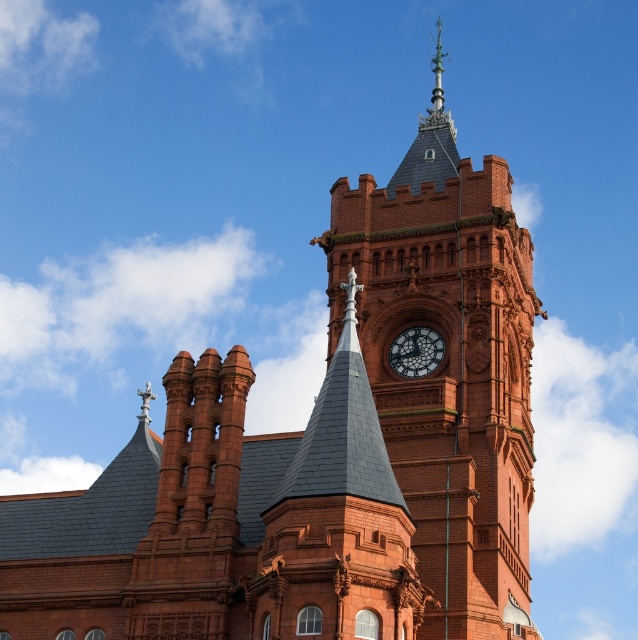
You are standing in front of a historic building. You notice a point marked at coordinates [449,365]. Based on the scene description, can you identify what architectural feature this point is likely pointing to?

The point at coordinates [449,365] corresponds to the matte brick clock tower at center.

You are an architect examining the building. You notice the matte brick clock tower at center and the polished brass clock at center. Which of these two objects is taller?

The matte brick clock tower at center is taller than the polished brass clock at center.

You are standing in front of the historic building and want to take a photo of the clock tower. According to the coordinates provided, where should you aim your camera to capture the matte brick clock tower at center?

You should aim your camera at the coordinates point [449,365] to capture the matte brick clock tower at center.